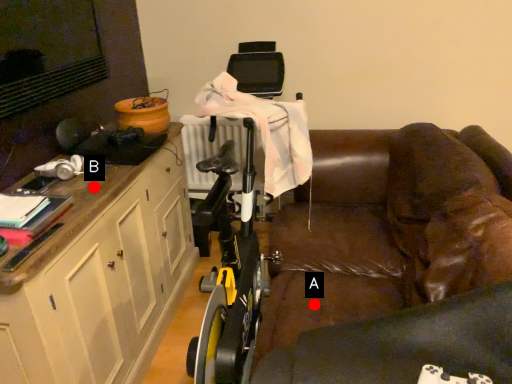
Question: Two points are circled on the image, labeled by A and B beside each circle. Among these points, which one is farthest from the camera?

Choices:
 (A) A is further
 (B) B is further

Answer: (A)